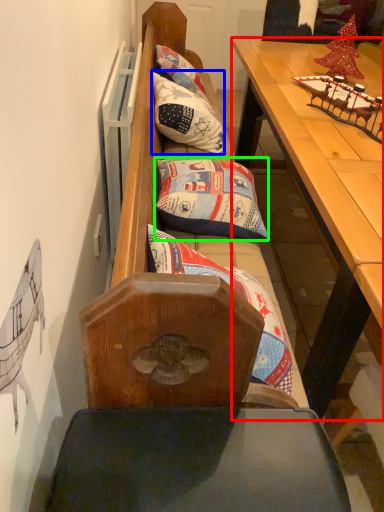
Question: Estimate the real-world distances between objects in this image. Which object is farther from table (highlighted by a red box), pillow (highlighted by a blue box) or pillow (highlighted by a green box)?

Choices:
 (A) pillow
 (B) pillow

Answer: (A)